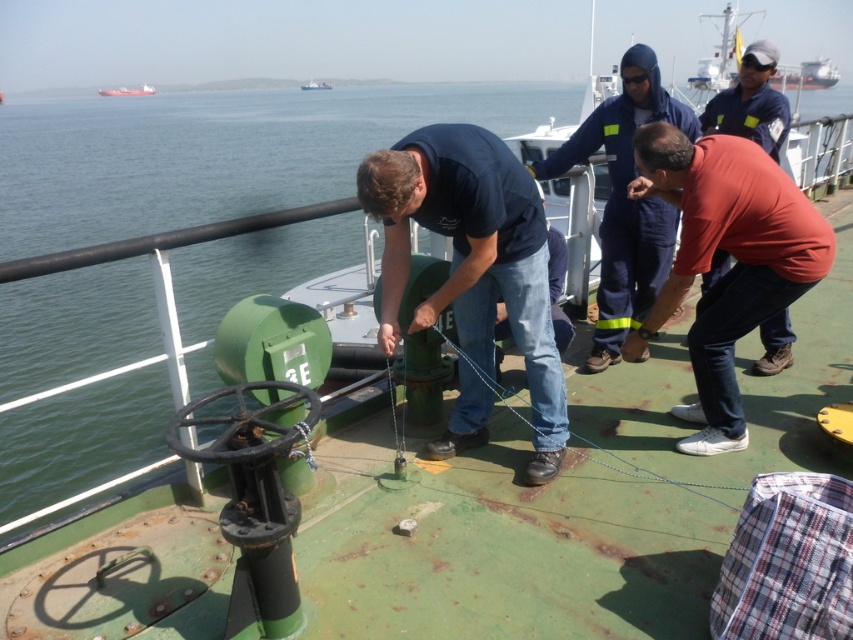
Does dark blue uniform at center appear under brushed metal boat at upper center?

Yes.

Where is `dark blue uniform at center`? dark blue uniform at center is located at coordinates (625, 200).

The height and width of the screenshot is (640, 853). I want to click on dark blue uniform at center, so (x=625, y=200).

Does point (494, 209) come behind point (123, 88)?

No.

Locate an element on the screen. The image size is (853, 640). matte green pipe at center is located at coordinates click(x=473, y=272).

Is point (728, 54) more distant than point (126, 96)?

No, (728, 54) is in front of (126, 96).

Does brushed metal boat at upper center appear on the left side of red matte cargo ship at upper left?

No, brushed metal boat at upper center is not to the left of red matte cargo ship at upper left.

Between point (741, 49) and point (107, 92), which one is positioned behind?

Point (107, 92)

You are a GUI agent. You are given a task and a screenshot of the screen. Output one action in this format:
    pyautogui.click(x=<x>, y=<y>)
    Task: Click on the brushed metal boat at upper center
    
    Given the screenshot: What is the action you would take?
    pyautogui.click(x=723, y=51)